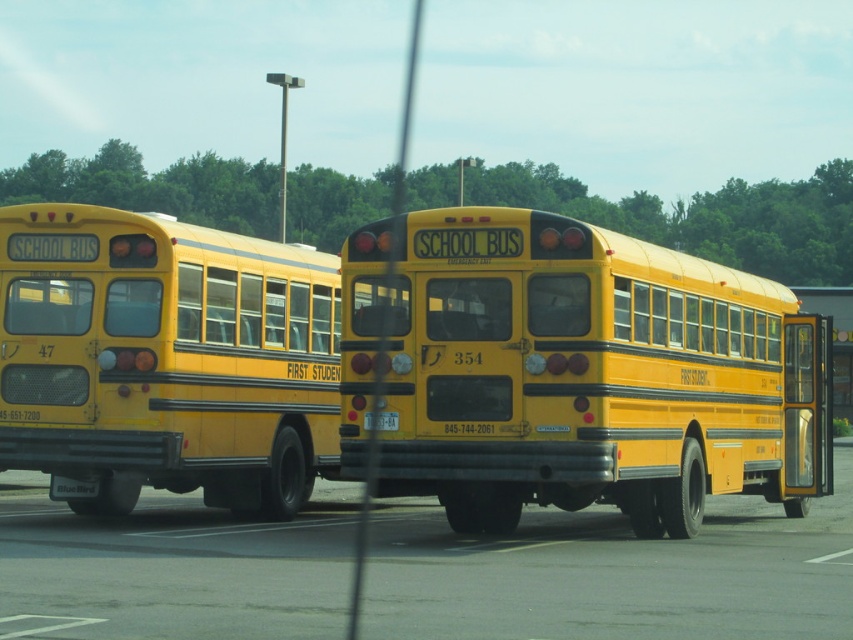
Is yellow matte/solid school bus at center wider than matte yellow school bus at left?

Indeed, yellow matte/solid school bus at center has a greater width compared to matte yellow school bus at left.

Between point (759, 392) and point (175, 356), which one is positioned behind?

Point (759, 392)

Does point (416, 234) come farther from viewer compared to point (82, 358)?

No, (416, 234) is closer to viewer.

Identify the location of yellow matte/solid school bus at center. The image size is (853, 640). (577, 372).

Is yellow matte/solid school bus at center positioned before yellow asphalt at lower center?

No, it is not.

The height and width of the screenshot is (640, 853). Identify the location of yellow matte/solid school bus at center. (577, 372).

Identify the location of yellow matte/solid school bus at center. (577, 372).

Who is positioned more to the right, yellow asphalt at lower center or matte yellow school bus at left?

Positioned to the right is yellow asphalt at lower center.

Is point (840, 618) in front of point (65, 241)?

Yes, it is in front of point (65, 241).

Measure the distance between point [581,525] and camera.

Point [581,525] is 14.24 meters from camera.

Where is `yellow asphalt at lower center`? The width and height of the screenshot is (853, 640). yellow asphalt at lower center is located at coordinates (614, 573).